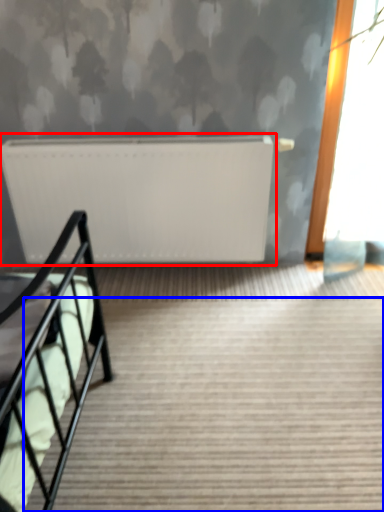
Question: Which of the following is the farthest to the observer, radiator (highlighted by a red box) or stairs (highlighted by a blue box)?

Choices:
 (A) radiator
 (B) stairs

Answer: (A)